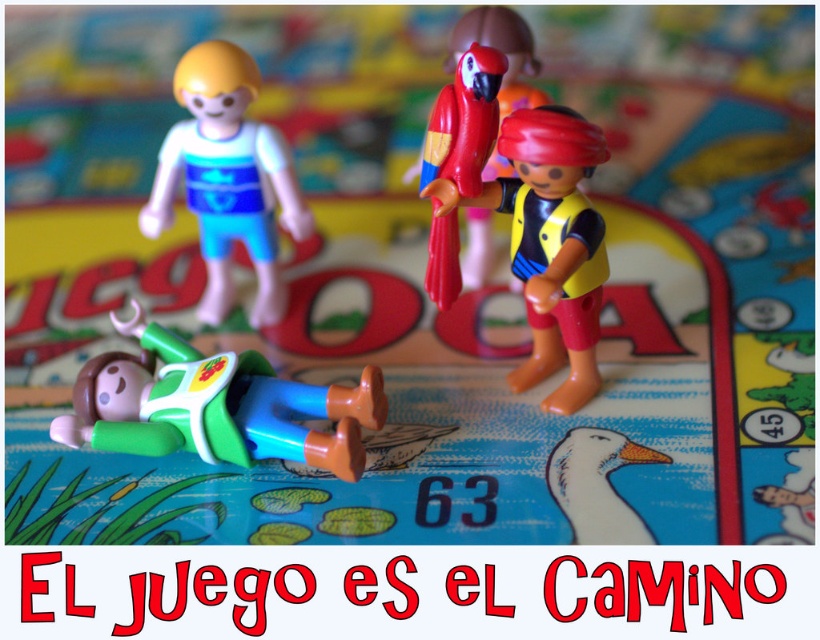
Which is below, matte yellow vest at center or white matte duck at lower center?

white matte duck at lower center is lower down.

Which is in front, point (554, 177) or point (663, 458)?

Positioned in front is point (554, 177).

The image size is (820, 640). Find the location of `matte yellow vest at center`. matte yellow vest at center is located at coordinates (549, 243).

Does green matte figure at lower left have a larger size compared to matte yellow vest at center?

Actually, green matte figure at lower left might be smaller than matte yellow vest at center.

Does green matte figure at lower left come in front of matte yellow vest at center?

No, green matte figure at lower left is further to the viewer.

What do you see at coordinates (215, 406) in the screenshot? I see `green matte figure at lower left` at bounding box center [215, 406].

Where is `green matte figure at lower left`? green matte figure at lower left is located at coordinates (215, 406).

Can you confirm if green matte figure at lower left is smaller than white matte duck at lower center?

No, green matte figure at lower left is not smaller than white matte duck at lower center.

Is green matte figure at lower left to the left of white matte duck at lower center from the viewer's perspective?

Correct, you'll find green matte figure at lower left to the left of white matte duck at lower center.

Which is in front, point (280, 410) or point (615, 490)?

Point (615, 490) is in front.

Locate an element on the screen. green matte figure at lower left is located at coordinates (215, 406).